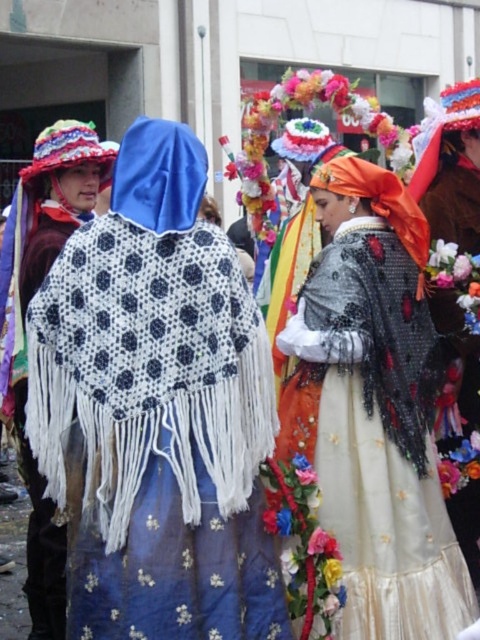
Is white knitted shawl at center bigger than shiny orange fabric at center?

Actually, white knitted shawl at center might be smaller than shiny orange fabric at center.

Does point (154, 177) come farther from viewer compared to point (368, 280)?

No, (154, 177) is closer to viewer.

This screenshot has height=640, width=480. What are the coordinates of `white knitted shawl at center` in the screenshot? It's located at (157, 410).

Between white knitted shawl at center and floral lace dress at center, which one appears on the right side from the viewer's perspective?

From the viewer's perspective, floral lace dress at center appears more on the right side.

Is white knitted shawl at center wider than floral lace dress at center?

Yes.

Does point (115, 467) come closer to viewer compared to point (479, 232)?

Yes, point (115, 467) is closer to viewer.

The height and width of the screenshot is (640, 480). Identify the location of white knitted shawl at center. (157, 410).

Between white knitted shawl at center and white knitted shawl at left, which one is positioned higher?

white knitted shawl at center is above.

Can you confirm if white knitted shawl at center is wider than white knitted shawl at left?

Yes, white knitted shawl at center is wider than white knitted shawl at left.

Does point (107, 490) come in front of point (28, 563)?

Yes, it is.

You are a GUI agent. You are given a task and a screenshot of the screen. Output one action in this format:
    pyautogui.click(x=<x>, y=<y>)
    Task: Click on the white knitted shawl at center
    The height and width of the screenshot is (640, 480).
    Given the screenshot: What is the action you would take?
    pyautogui.click(x=157, y=410)